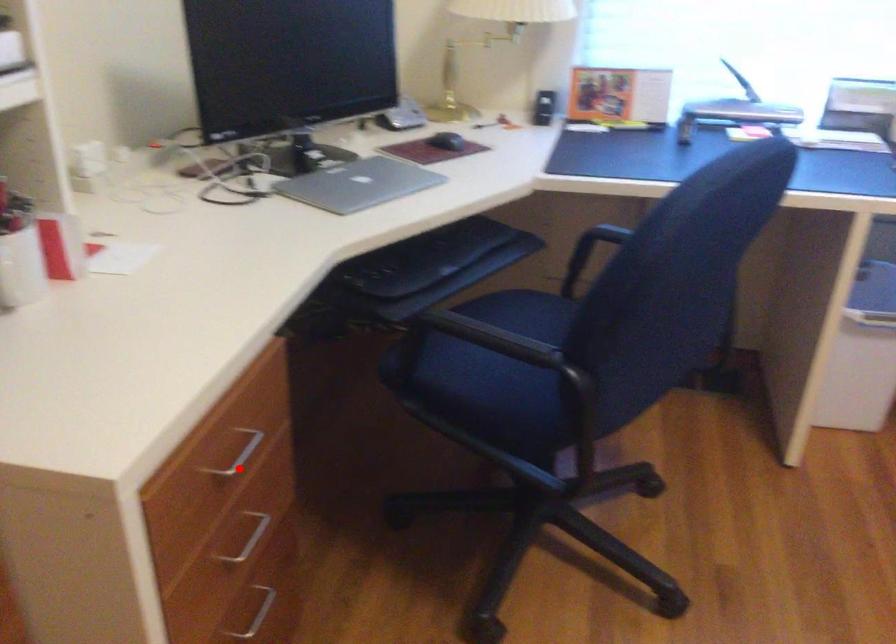
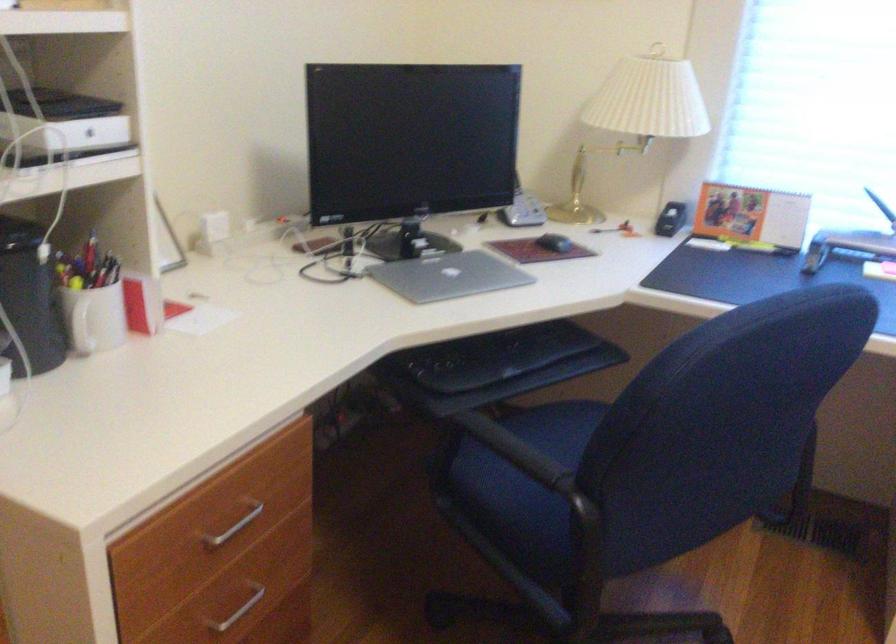
In the second image, find the point that corresponds to the highlighted location in the first image.

(231, 527)